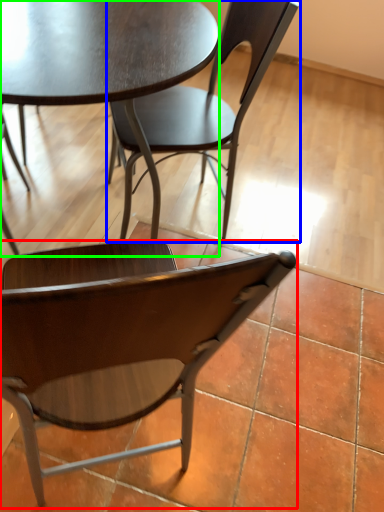
Question: Estimate the real-world distances between objects in this image. Which object is farther from chair (highlighted by a red box), chair (highlighted by a blue box) or coffee table (highlighted by a green box)?

Choices:
 (A) chair
 (B) coffee table

Answer: (A)